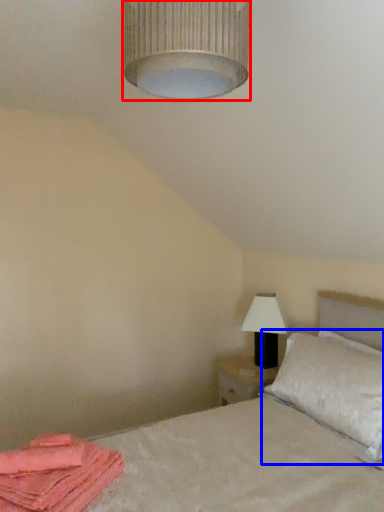
Question: Which of the following is the closest to the observer, lamp (highlighted by a red box) or pillow (highlighted by a blue box)?

Choices:
 (A) lamp
 (B) pillow

Answer: (A)